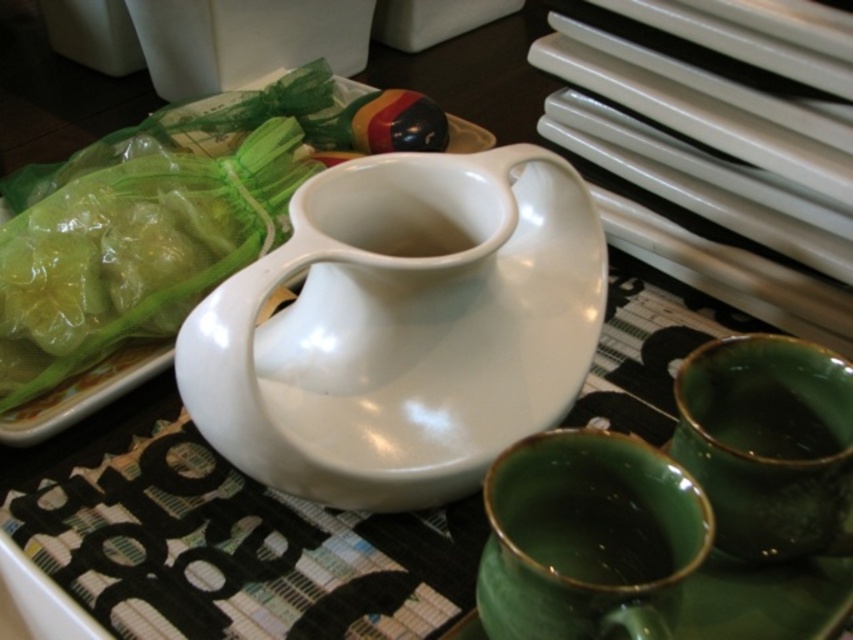
The width and height of the screenshot is (853, 640). What do you see at coordinates (189, 189) in the screenshot? I see `white glossy bowl at center` at bounding box center [189, 189].

Does white glossy bowl at center have a lesser width compared to green glossy cups at lower right?

No.

Is point (339, 108) behind point (799, 518)?

That is True.

The image size is (853, 640). I want to click on white glossy bowl at center, so click(189, 189).

Does white glossy jug at center appear over green glossy cups at lower right?

Indeed, white glossy jug at center is positioned over green glossy cups at lower right.

Is white glossy jug at center wider than green glossy cups at lower right?

Yes.

What do you see at coordinates (403, 326) in the screenshot? I see `white glossy jug at center` at bounding box center [403, 326].

The height and width of the screenshot is (640, 853). Identify the location of white glossy jug at center. (403, 326).

Does green glossy gravy boat at lower right appear on the left side of green glossy cups at lower right?

Correct, you'll find green glossy gravy boat at lower right to the left of green glossy cups at lower right.

Between green glossy gravy boat at lower right and green glossy cups at lower right, which one has less height?

With less height is green glossy gravy boat at lower right.

Where is `green glossy gravy boat at lower right`? This screenshot has height=640, width=853. green glossy gravy boat at lower right is located at coordinates (587, 538).